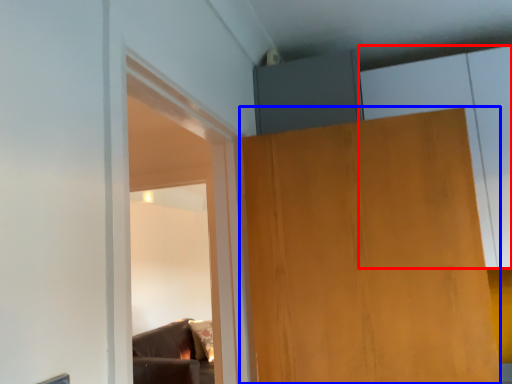
Question: Which object appears closest to the camera in this image, cabinetry (highlighted by a red box) or door (highlighted by a blue box)?

Choices:
 (A) cabinetry
 (B) door

Answer: (B)